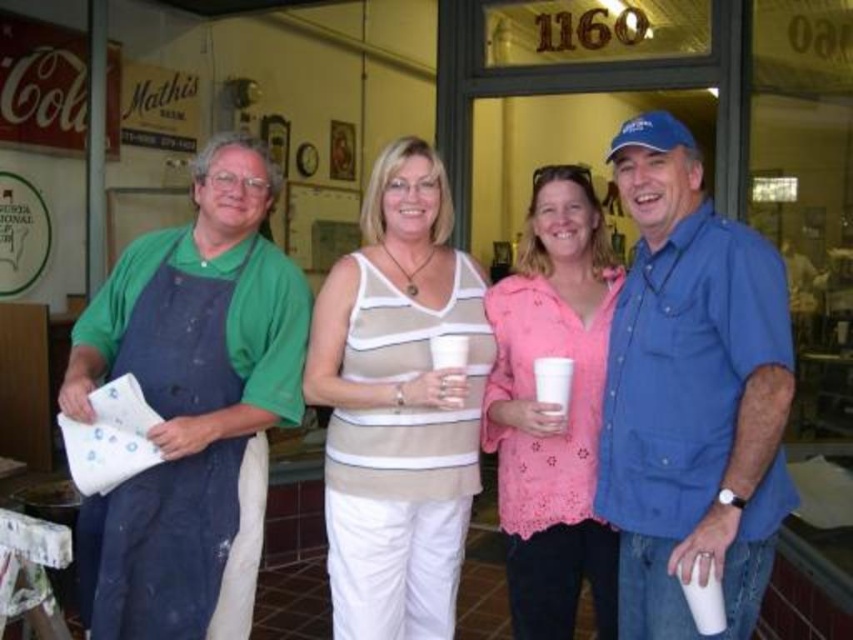
Based on the photo, can you confirm if beige striped tank top at center is taller than pink lace blouse at center?

Correct, beige striped tank top at center is much taller as pink lace blouse at center.

Describe the element at coordinates (398, 404) in the screenshot. I see `beige striped tank top at center` at that location.

Locate an element on the screen. The width and height of the screenshot is (853, 640). beige striped tank top at center is located at coordinates (398, 404).

Between blue cotton shirt at right and pink lace blouse at center, which one is positioned lower?

pink lace blouse at center

Which of these two, blue cotton shirt at right or pink lace blouse at center, stands taller?

pink lace blouse at center is taller.

Between point (755, 358) and point (552, 529), which one is positioned in front?

Point (755, 358) is in front.

Where is `blue cotton shirt at right`? The image size is (853, 640). blue cotton shirt at right is located at coordinates (691, 394).

Does point (225, 557) come behind point (381, 419)?

No, it is not.

Is green fabric apron at left closer to the viewer compared to beige striped tank top at center?

That is True.

You are a GUI agent. You are given a task and a screenshot of the screen. Output one action in this format:
    pyautogui.click(x=<x>, y=<y>)
    Task: Click on the green fabric apron at left
    
    Given the screenshot: What is the action you would take?
    pyautogui.click(x=190, y=404)

You are a GUI agent. You are given a task and a screenshot of the screen. Output one action in this format:
    pyautogui.click(x=<x>, y=<y>)
    Task: Click on the green fabric apron at left
    The image size is (853, 640).
    Given the screenshot: What is the action you would take?
    pyautogui.click(x=190, y=404)